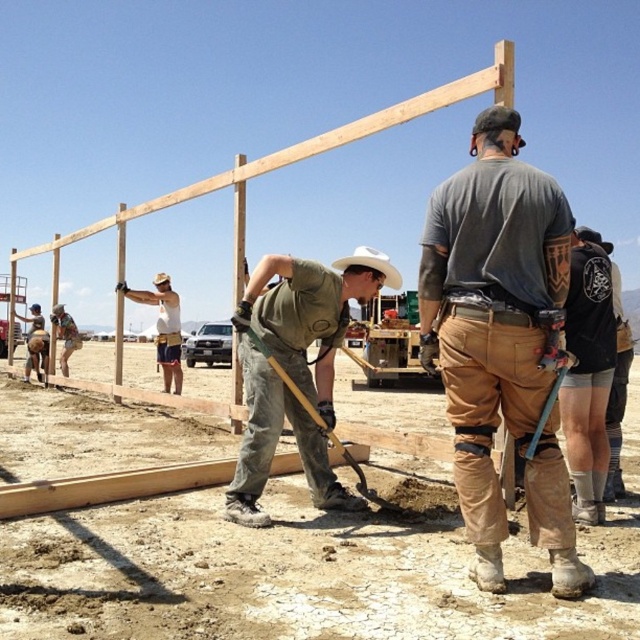
Question: Can you confirm if brown/khaki pants at center is positioned above green matte shirt at center?

Choices:
 (A) no
 (B) yes

Answer: (B)

Question: Can you confirm if brown/khaki pants at center is smaller than green matte shirt at center?

Choices:
 (A) no
 (B) yes

Answer: (B)

Question: Can you confirm if brown/khaki pants at center is wider than green matte shirt at center?

Choices:
 (A) yes
 (B) no

Answer: (B)

Question: Which object appears closest to the camera in this image?

Choices:
 (A) brown/khaki pants at center
 (B) green matte shirt at center

Answer: (A)

Question: Which of the following is the closest to the observer?

Choices:
 (A) brown/khaki pants at center
 (B) green matte shirt at center

Answer: (A)